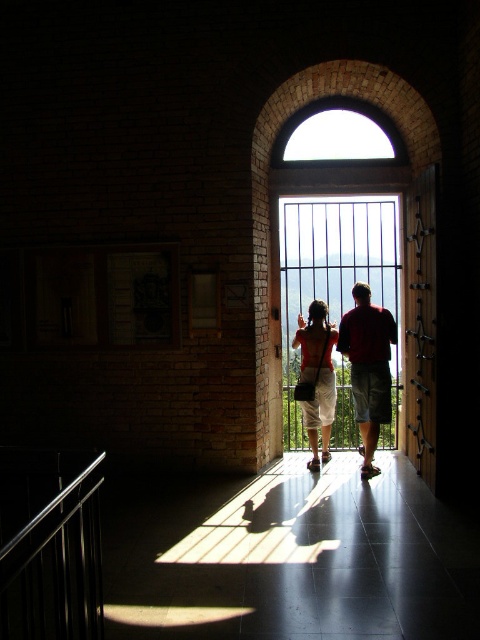
Can you confirm if clear glass window at center is positioned to the right of dark red shirt at center?

Incorrect, clear glass window at center is not on the right side of dark red shirt at center.

Between clear glass window at center and dark red shirt at center, which one has less height?

With less height is dark red shirt at center.

Does point (352, 417) come behind point (371, 460)?

Yes.

Where is `clear glass window at center`? clear glass window at center is located at coordinates (332, 269).

Between polished metal balustrade at lower left and matte red shirt at center, which one is positioned lower?

polished metal balustrade at lower left

Is point (28, 499) more distant than point (311, 468)?

No, it is in front of (311, 468).

Does point (40, 557) come behind point (315, 369)?

No.

The height and width of the screenshot is (640, 480). In order to click on polished metal balustrade at lower left in this screenshot , I will do `click(49, 545)`.

Is dark red shirt at center to the left of matte red shirt at center from the viewer's perspective?

Incorrect, dark red shirt at center is not on the left side of matte red shirt at center.

Who is taller, dark red shirt at center or matte red shirt at center?

dark red shirt at center is taller.

Which is in front, point (355, 289) or point (317, 394)?

Point (355, 289) is more forward.

The height and width of the screenshot is (640, 480). Find the location of `dark red shirt at center`. dark red shirt at center is located at coordinates (369, 368).